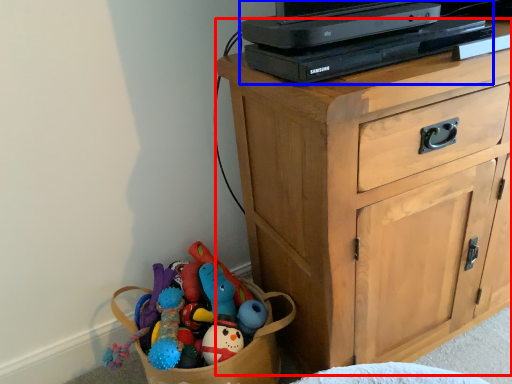
Question: Which of the following is the farthest to the observer, chest of drawers (highlighted by a red box) or computer (highlighted by a blue box)?

Choices:
 (A) chest of drawers
 (B) computer

Answer: (B)